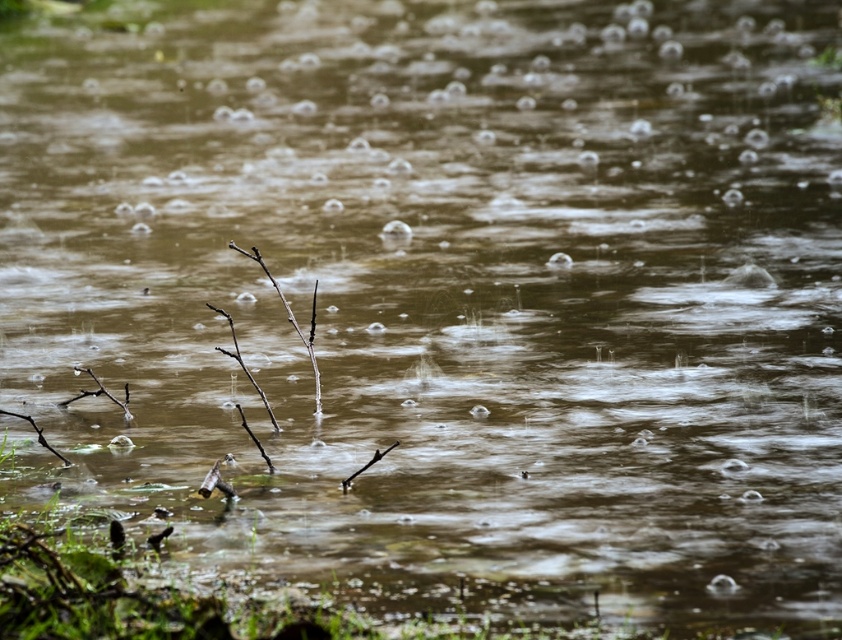
You are a drone operator trying to capture a closeup of the brown matte branch at center. The drone is currently at point 0.500, 0.348. Is the drone already positioned directly above the branch?

The position of brown matte branch at center is at point (292, 320), so yes, the drone is already positioned directly above the branch.

In the scene shown: You are a small frog trying to jump from the brown twig at lower left to the brown matte branch at center. Considering their sizes, which object would provide a more stable landing surface?

The brown matte branch at center is larger in size than the brown twig at lower left, so it would provide a more stable landing surface for the frog.